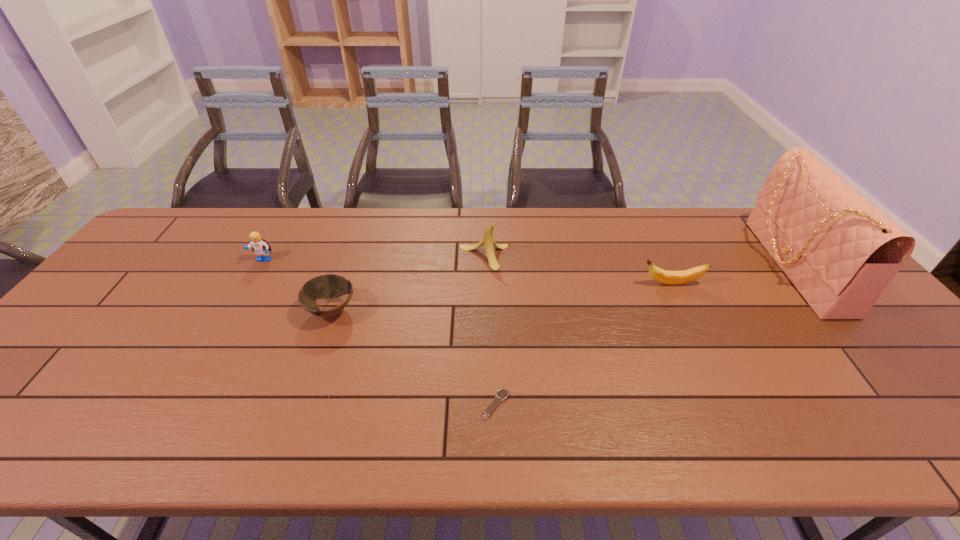
This screenshot has height=540, width=960. I want to click on watch, so click(502, 394).

Where is `free space located 0.390m on the front-facing side of the rightmost object`? free space located 0.390m on the front-facing side of the rightmost object is located at coordinates point(634,266).

Where is `free space located on the front-facing side of the rightmost object`? The height and width of the screenshot is (540, 960). free space located on the front-facing side of the rightmost object is located at coordinates (631, 266).

This screenshot has width=960, height=540. Find the location of `vacant space located on the front-facing side of the rightmost object`. vacant space located on the front-facing side of the rightmost object is located at coordinates (694, 266).

You are a GUI agent. You are given a task and a screenshot of the screen. Output one action in this format:
    pyautogui.click(x=<x>, y=<y>)
    Task: Click on the vacant region located 0.070m on the front of the second tallest object
    Image resolution: width=960 pixels, height=540 pixels.
    Given the screenshot: What is the action you would take?
    pyautogui.click(x=486, y=287)

In order to click on vacant space located on the front-facing side of the leftmost object in this screenshot , I will do `click(199, 374)`.

Locate an element on the screen. The width and height of the screenshot is (960, 540). vacant area situated 0.090m at the stem of the shorter banana is located at coordinates (609, 284).

I want to click on free space located at the stem of the shorter banana, so click(x=598, y=284).

The image size is (960, 540). In order to click on free region located at the stem of the shorter banana in this screenshot , I will do `click(609, 284)`.

At what (x,y) coordinates should I click in order to perform the action: click on vacant point located 0.250m on the back of the bowl. Please return your answer as a coordinate pair (x, y). Looking at the image, I should click on (356, 239).